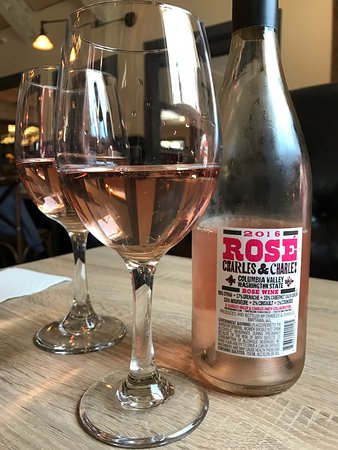
Find the location of `table top`. table top is located at coordinates (29, 390), (109, 280), (176, 289), (271, 424), (323, 328).